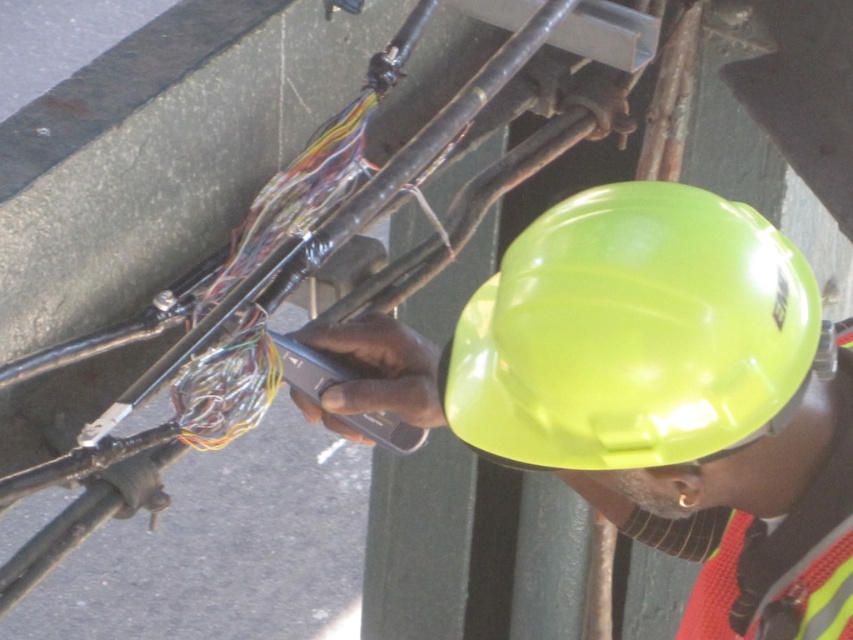
Question: Among these points, which one is nearest to the camera?

Choices:
 (A) (535, 349)
 (B) (631, 387)

Answer: (B)

Question: Which of the following is the farthest from the observer?

Choices:
 (A) (418, 417)
 (B) (444, 376)

Answer: (A)

Question: Which object is closer to the camera taking this photo?

Choices:
 (A) glossy hard hat at center
 (B) neon yellow hard hat at center

Answer: (A)

Question: Considering the relative positions of neon yellow hard hat at center and glossy hard hat at center in the image provided, where is neon yellow hard hat at center located with respect to glossy hard hat at center?

Choices:
 (A) below
 (B) above

Answer: (A)

Question: Does neon yellow hard hat at center have a larger size compared to glossy hard hat at center?

Choices:
 (A) yes
 (B) no

Answer: (A)

Question: Does neon yellow hard hat at center appear on the right side of glossy hard hat at center?

Choices:
 (A) no
 (B) yes

Answer: (B)